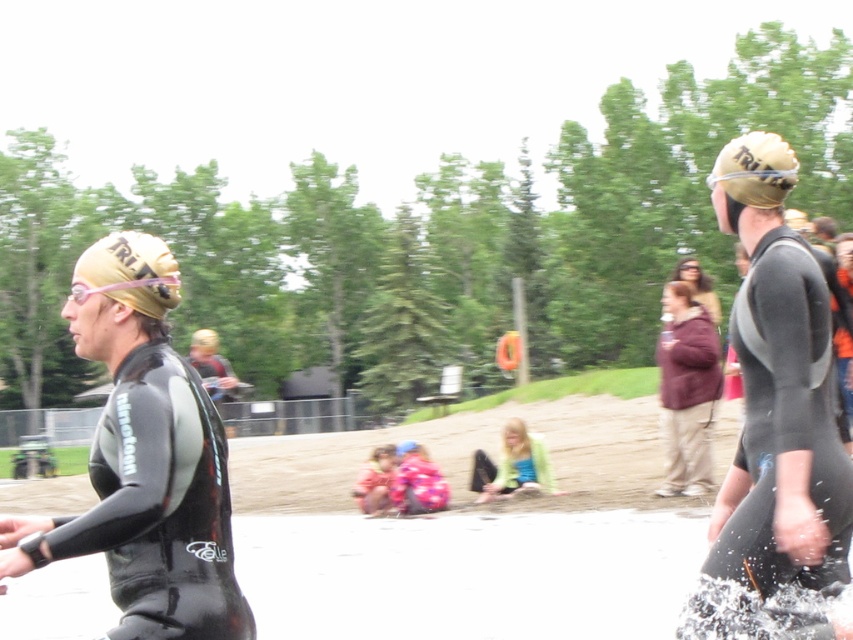
Can you confirm if matte green jacket at center is shorter than matte gold helmet at upper center?

Yes, matte green jacket at center is shorter than matte gold helmet at upper center.

Is matte green jacket at center positioned behind matte gold helmet at upper center?

That is True.

Which is behind, point (531, 472) or point (717, 314)?

The point (531, 472) is behind.

The image size is (853, 640). Identify the location of matte green jacket at center. (514, 465).

Is maroon fleece jacket at center thinner than matte gold helmet at upper center?

Yes, maroon fleece jacket at center is thinner than matte gold helmet at upper center.

Measure the distance from maroon fleece jacket at center to matte gold helmet at upper center.

The distance of maroon fleece jacket at center from matte gold helmet at upper center is 3.50 meters.

Does point (701, 412) come behind point (711, 298)?

No, (701, 412) is in front of (711, 298).

Locate an element on the screen. maroon fleece jacket at center is located at coordinates (688, 388).

Consider the image. Can you confirm if matte black wetsuit at right is wider than matte gold helmet at upper center?

In fact, matte black wetsuit at right might be narrower than matte gold helmet at upper center.

Is point (825, 499) positioned before point (691, 289)?

Yes, it is.

You are a GUI agent. You are given a task and a screenshot of the screen. Output one action in this format:
    pyautogui.click(x=<x>, y=<y>)
    Task: Click on the matte black wetsuit at right
    This screenshot has height=640, width=853.
    Given the screenshot: What is the action you would take?
    pyautogui.click(x=778, y=390)